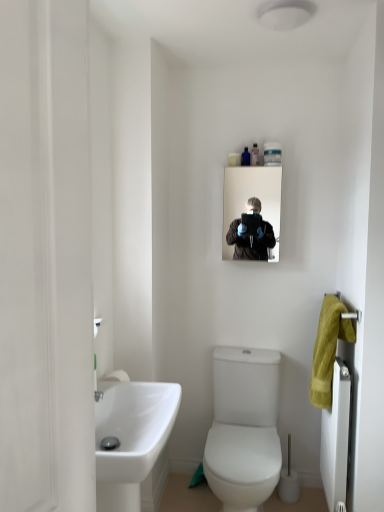
Locate an element on the screen. This screenshot has height=512, width=384. free spot above matte black mirror at upper center (from a real-world perspective) is located at coordinates pos(259,163).